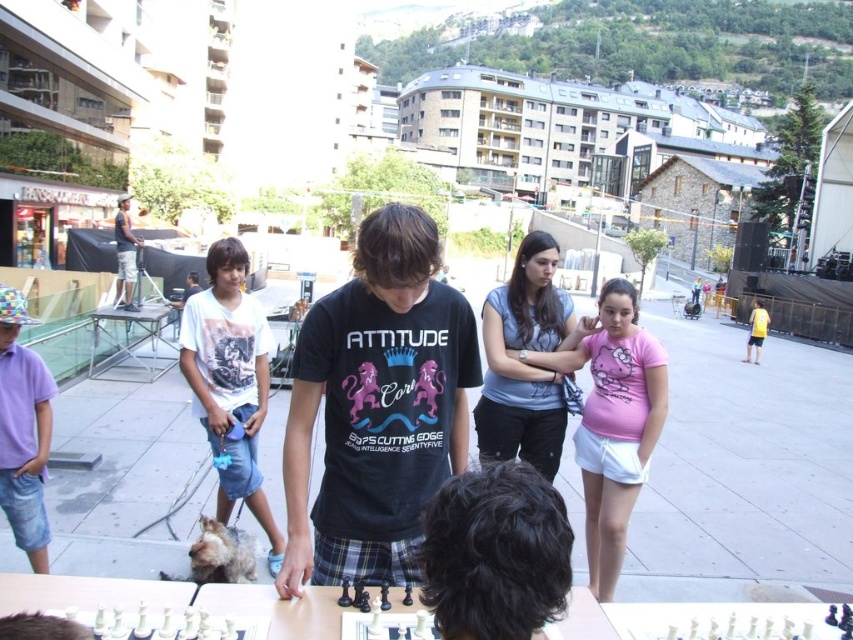
You are a photographer standing at the edge of the plaza, and you want to take a photo of both the black cotton shirt at center and the pink cotton shirt at center. Which shirt should you focus on first to ensure both are in the frame?

The black cotton shirt at center is much taller than the pink cotton shirt at center, so you should focus on the black cotton shirt at center first to ensure both are in the frame.

You are a photographer trying to capture a candid shot of the black cotton shirt at center and the dark blue denim shorts at left. Since you want to ensure both are clearly visible, which object should you focus on first to account for their sizes?

The black cotton shirt at center is larger than the dark blue denim shorts at left, so you should focus on the black cotton shirt at center first to ensure its details are sharp before adjusting for the smaller dark blue denim shorts at left.